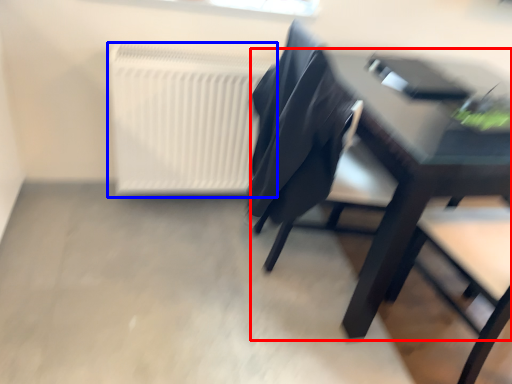
Question: Which of the following is the closest to the observer, table (highlighted by a red box) or radiator (highlighted by a blue box)?

Choices:
 (A) table
 (B) radiator

Answer: (A)